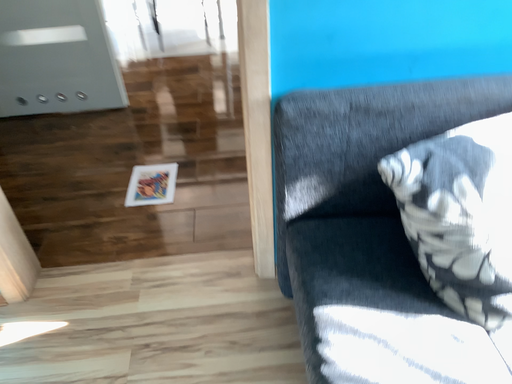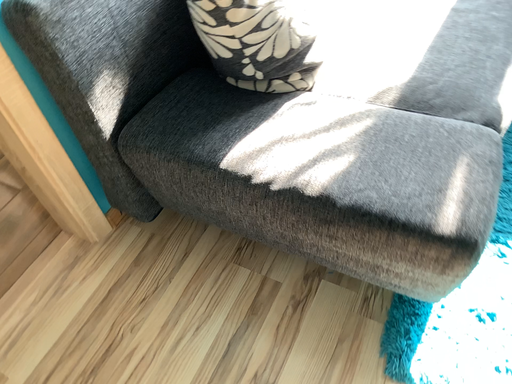
Question: Which way did the camera rotate in the video?

Choices:
 (A) rotated upward
 (B) rotated downward

Answer: (A)